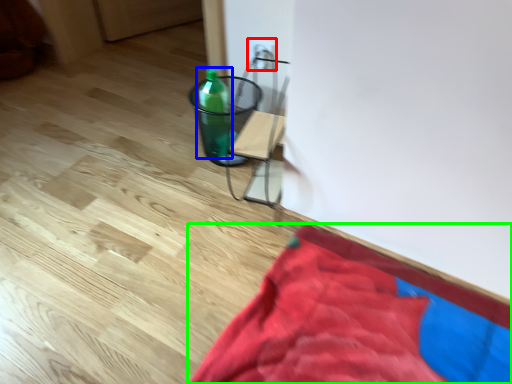
Question: Considering the real-world distances, which object is closest to electric outlet (highlighted by a red box)? bottle (highlighted by a blue box) or blanket (highlighted by a green box).

Choices:
 (A) bottle
 (B) blanket

Answer: (A)